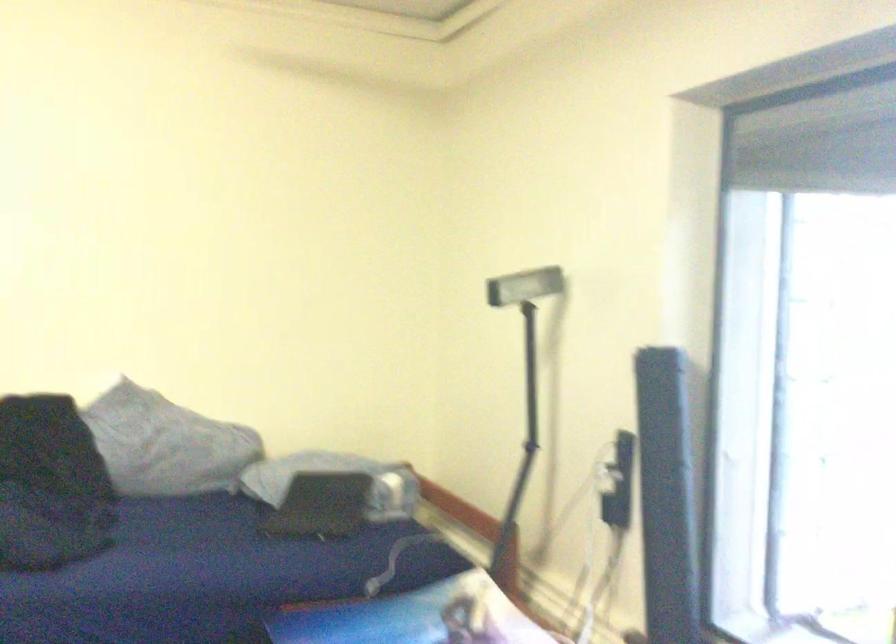
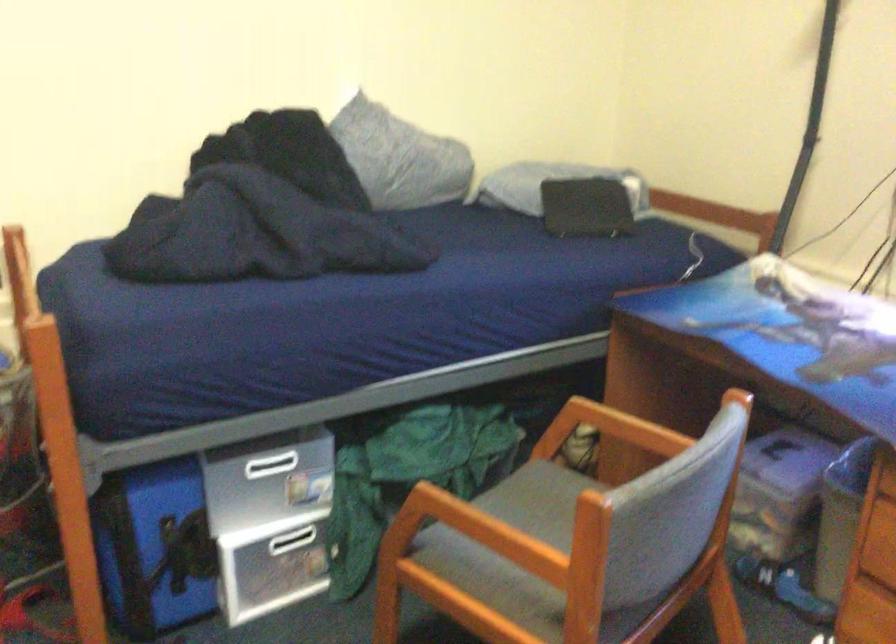
In the second image, find the point that corresponds to point (319, 509) in the first image.

(586, 207)